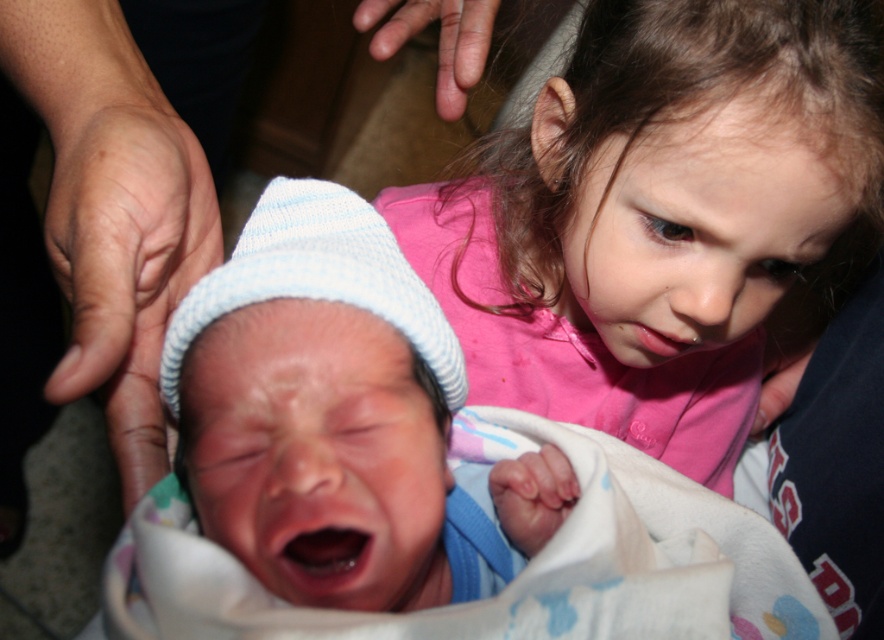
Between point (367, 204) and point (452, 266), which one is positioned behind?

Positioned behind is point (452, 266).

Where is `blue knit hat at center`? blue knit hat at center is located at coordinates (394, 472).